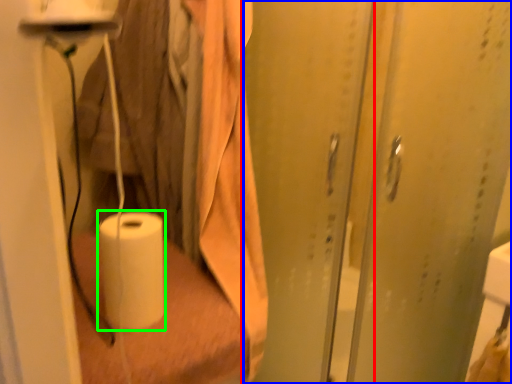
Question: Which object is the closest to the screen door (highlighted by a red box)? Choose among these: screen door (highlighted by a blue box) or paper towel (highlighted by a green box).

Choices:
 (A) screen door
 (B) paper towel

Answer: (A)